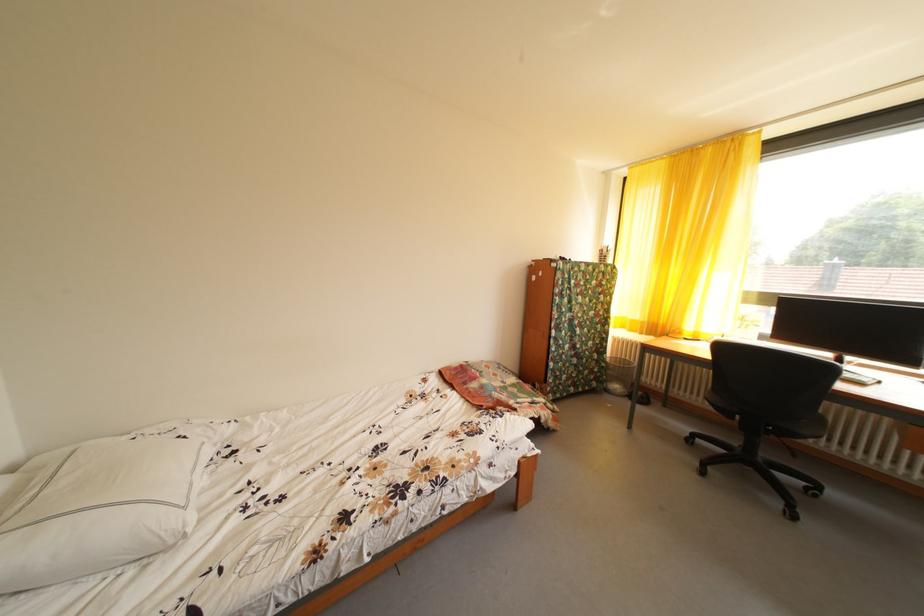
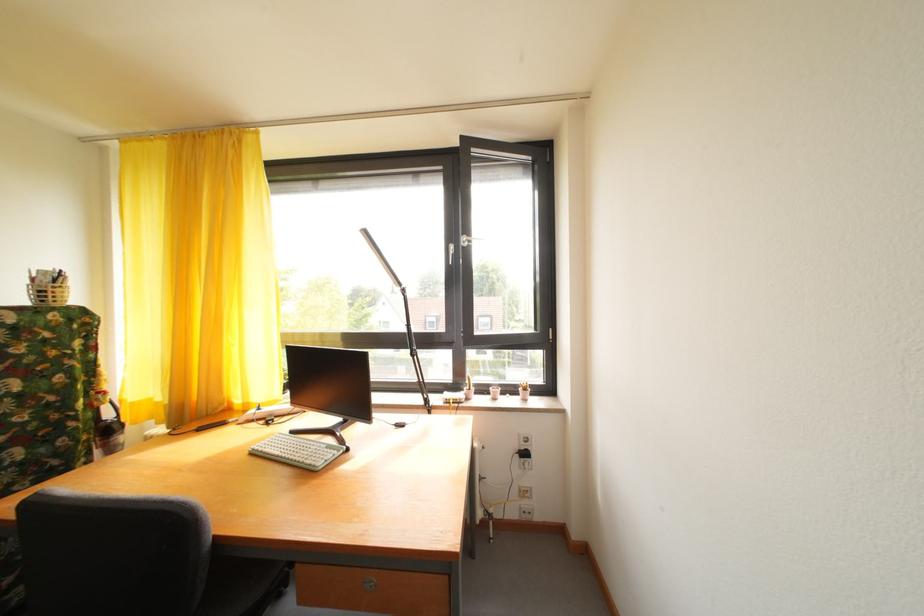
Find the pixel in the second image that matches (x=611, y=257) in the first image.

(43, 286)